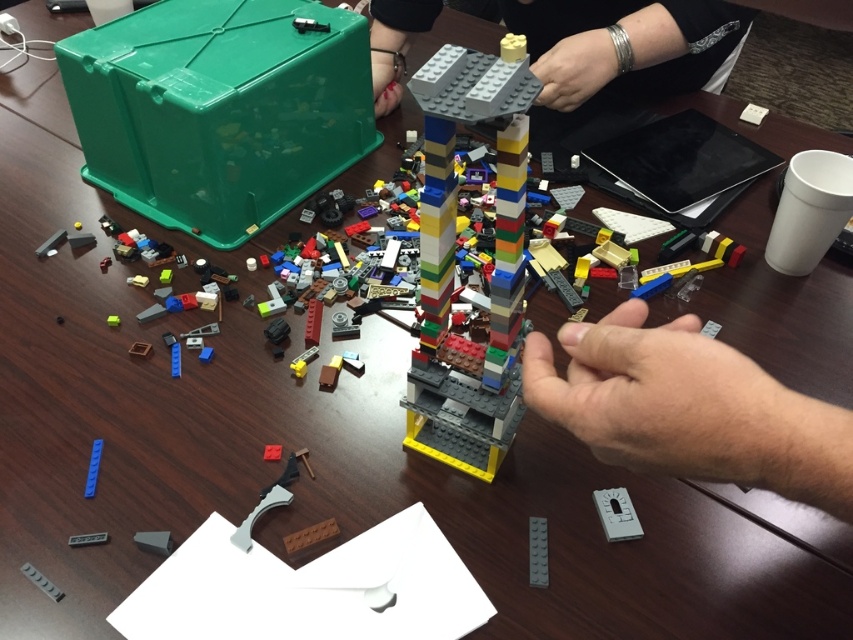
You are a LEGO builder trying to place a new piece onto the multicolored plastic tower at center. There is a smooth gray lego piece at upper center above it. Can you reach the tower without moving the gray piece?

The multicolored plastic tower at center is closer to the viewer than the smooth gray lego piece at upper center, so you can reach the tower without moving the gray piece because it is farther away.

You are trying to place a LEGO piece onto the structure. Can the smooth gray hand at center reach the smooth gray lego piece at upper center?

The smooth gray hand at center has a lesser height compared to the smooth gray lego piece at upper center, so the hand cannot reach it.

You are a robot trying to place a new LEGO piece on the multicolored plastic tower at center. What are the coordinates where you should aim to place the new piece?

The coordinates for placing the new LEGO piece on the multicolored plastic tower at center are at point [453,260].